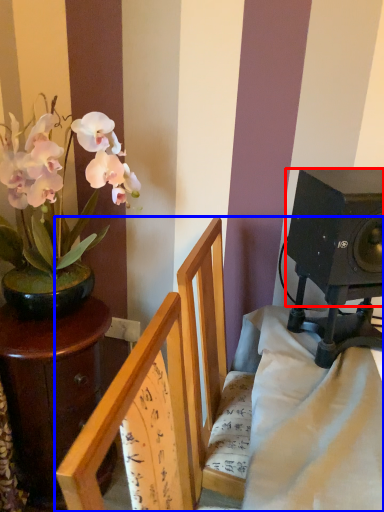
Question: Which point is closer to the camera, loudspeaker (highlighted by a red box) or furniture (highlighted by a blue box)?

Choices:
 (A) loudspeaker
 (B) furniture

Answer: (B)